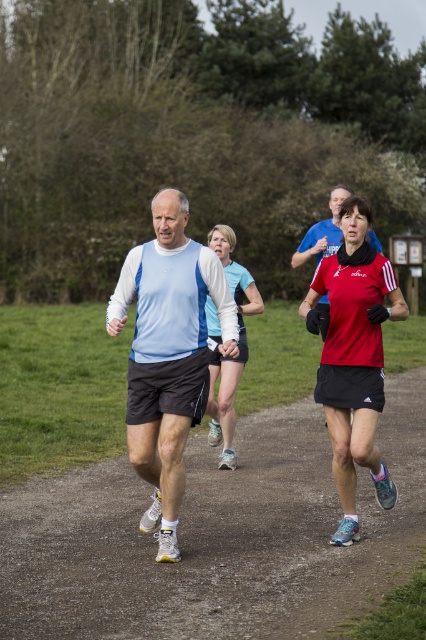
Question: Which object is the closest to the matte red running top at center?

Choices:
 (A) matte blue shirt at center
 (B) light blue fabric shirt at center
 (C) matte blue top at center

Answer: (A)

Question: Is light blue fabric shirt at center above matte blue shirt at center?

Choices:
 (A) yes
 (B) no

Answer: (B)

Question: Does light blue fabric shirt at center have a lesser width compared to matte blue shirt at center?

Choices:
 (A) yes
 (B) no

Answer: (A)

Question: Among these objects, which one is farthest from the camera?

Choices:
 (A) light blue fabric shirt at center
 (B) matte blue shirt at center
 (C) matte red running top at center
 (D) brown dirt path at center

Answer: (B)

Question: Does matte red running top at center have a lesser width compared to matte blue top at center?

Choices:
 (A) yes
 (B) no

Answer: (B)

Question: Among these objects, which one is farthest from the camera?

Choices:
 (A) matte blue shirt at center
 (B) matte red running top at center
 (C) light blue fabric shirt at center
 (D) brown dirt path at center

Answer: (A)